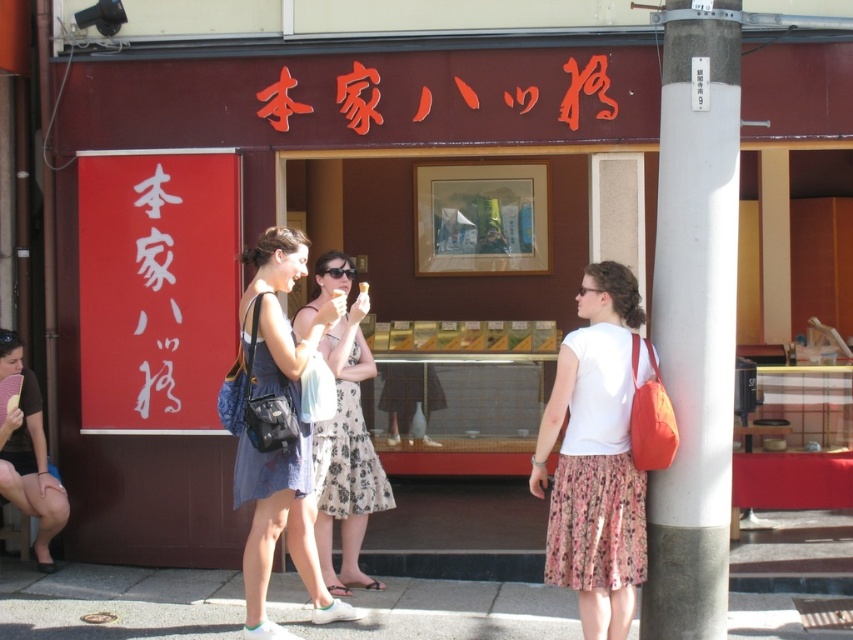
You are standing on the concrete sidewalk at lower center and want to reach the white creamy ice cream at center. Which direction should you move to get closer to the ice cream?

You should move forward because the concrete sidewalk at lower center is in front of the white creamy ice cream at center, meaning the ice cream is behind you relative to your position on the sidewalk.

You are a delivery person who needs to place a small package on the surface that can hold it. Which object between the concrete sidewalk at lower center and the white creamy ice cream at center would be more suitable for placing the package?

The concrete sidewalk at lower center is larger in size than the white creamy ice cream at center, so the concrete sidewalk at lower center would be more suitable for placing the package as it can support the weight and has enough space.